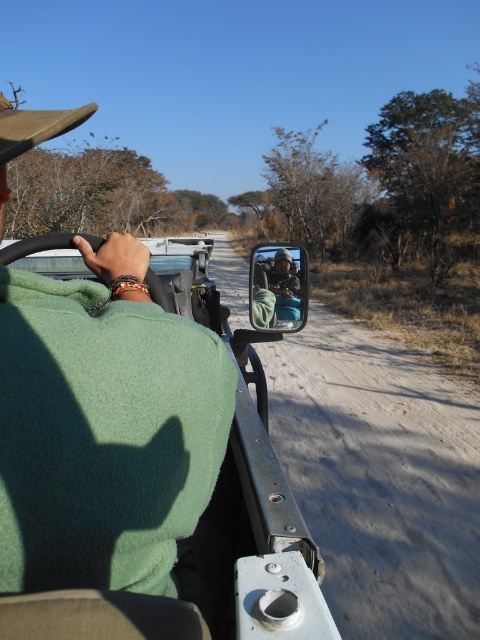
Does metallic side mirror at center appear under matte black jacket at center?

Yes, metallic side mirror at center is below matte black jacket at center.

Who is positioned more to the right, metallic side mirror at center or matte black jacket at center?

matte black jacket at center

Find the location of a particular element. This screenshot has height=640, width=480. metallic side mirror at center is located at coordinates (210, 525).

Between point (54, 129) and point (292, 264), which one is positioned in front?

Positioned in front is point (54, 129).

Which is in front, point (90, 113) or point (296, 304)?

Point (90, 113)

I want to click on brown felt cowboy hat at upper left, so click(x=35, y=125).

Does metallic side mirror at center have a lesser width compared to brown felt cowboy hat at upper left?

Correct, metallic side mirror at center's width is less than brown felt cowboy hat at upper left's.

Does metallic side mirror at center appear on the left side of brown felt cowboy hat at upper left?

No, metallic side mirror at center is not to the left of brown felt cowboy hat at upper left.

Is point (94, 620) positioned after point (66, 131)?

No, (94, 620) is closer to viewer.

This screenshot has height=640, width=480. In order to click on metallic side mirror at center in this screenshot , I will do `click(210, 525)`.